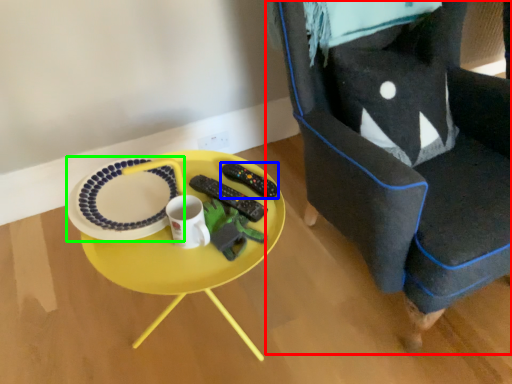
Question: Based on their relative distances, which object is nearer to chair (highlighted by a red box)? Choose from remote control (highlighted by a blue box) and platter (highlighted by a green box).

Choices:
 (A) remote control
 (B) platter

Answer: (A)